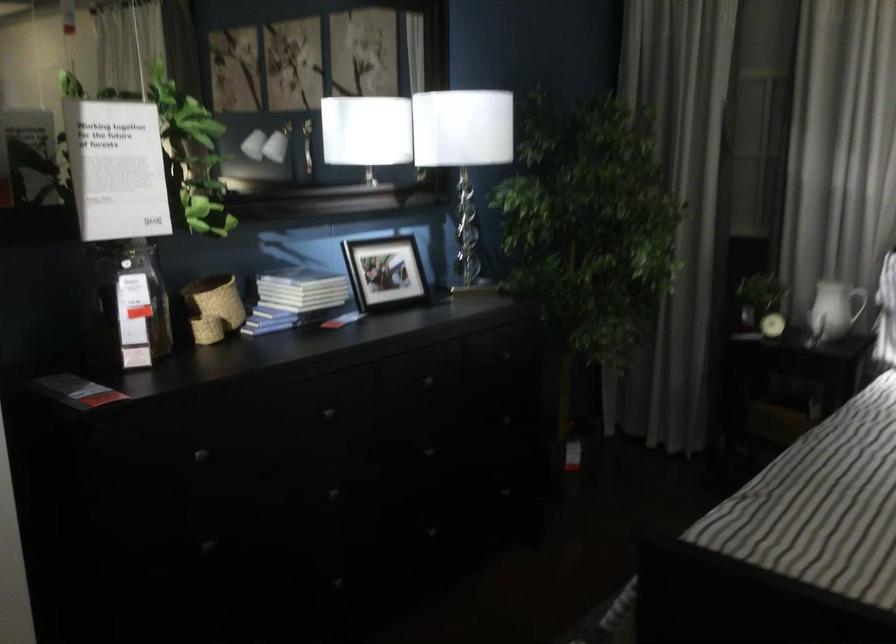
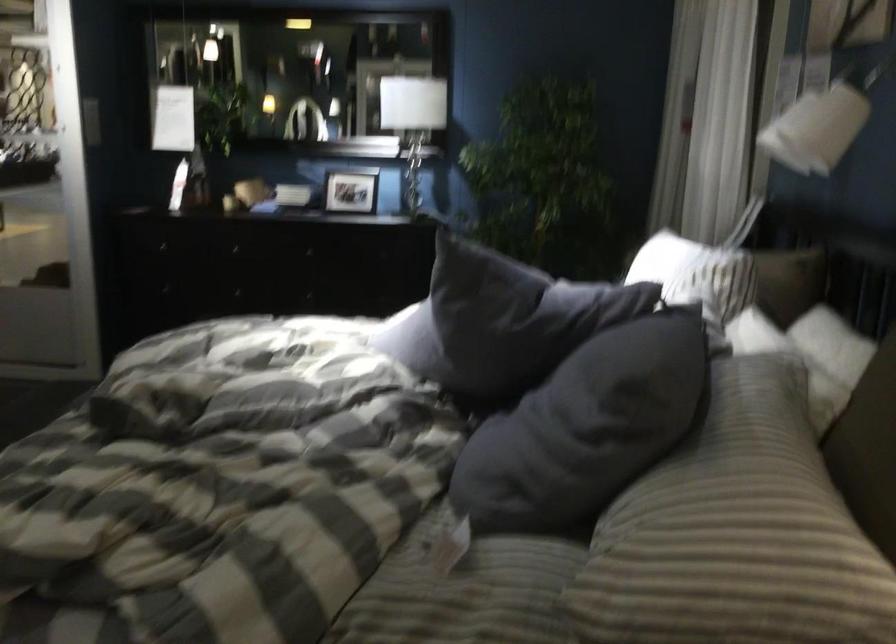
Question: I am providing you with two images of the same scene from different viewpoints. Which of the following objects are not visible in image2?

Choices:
 (A) white pitcher handle
 (B) stack of books
 (C) small picture frame
 (D) black bicycle tire

Answer: (A)